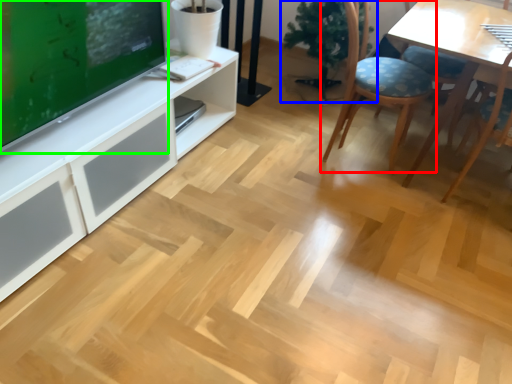
Question: Considering the real-world distances, which object is closest to chair (highlighted by a red box)? houseplant (highlighted by a blue box) or television (highlighted by a green box).

Choices:
 (A) houseplant
 (B) television

Answer: (A)